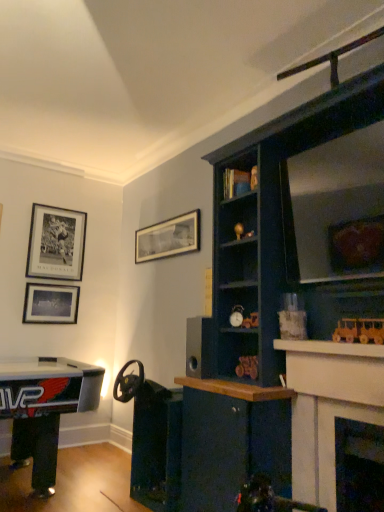
Find the location of `empty space that is ontop of wooden train at right, marked as the 1th toy in a right-to-left arrangement`. empty space that is ontop of wooden train at right, marked as the 1th toy in a right-to-left arrangement is located at coordinates (363, 319).